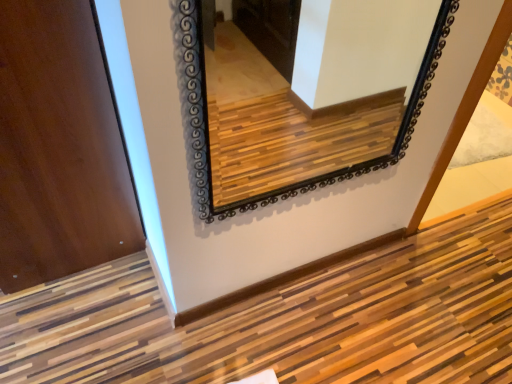
Where is `black glass mirror at upper center`? black glass mirror at upper center is located at coordinates (309, 93).

This screenshot has height=384, width=512. What do you see at coordinates (309, 93) in the screenshot? I see `black glass mirror at upper center` at bounding box center [309, 93].

What do you see at coordinates (59, 148) in the screenshot? This screenshot has height=384, width=512. I see `matte wood door at left` at bounding box center [59, 148].

Identify the location of matte wood door at left. This screenshot has width=512, height=384. (59, 148).

I want to click on black glass mirror at upper center, so click(309, 93).

Considering the relative positions of matte wood door at left and black glass mirror at upper center in the image provided, is matte wood door at left to the left of black glass mirror at upper center from the viewer's perspective?

Yes, matte wood door at left is to the left of black glass mirror at upper center.

Which object is further away from the camera, matte wood door at left or black glass mirror at upper center?

matte wood door at left is behind.

Considering the points (126, 196) and (369, 167), which point is in front, point (126, 196) or point (369, 167)?

The point (369, 167) is in front.

From the picture: From the image's perspective, is matte wood door at left above black glass mirror at upper center?

Yes.

From a real-world perspective, is matte wood door at left located higher than black glass mirror at upper center?

No, from a real-world perspective, matte wood door at left is not on top of black glass mirror at upper center.

Considering the relative sizes of matte wood door at left and black glass mirror at upper center in the image provided, is matte wood door at left wider than black glass mirror at upper center?

Indeed, matte wood door at left has a greater width compared to black glass mirror at upper center.

Considering the sizes of objects matte wood door at left and black glass mirror at upper center in the image provided, who is shorter, matte wood door at left or black glass mirror at upper center?

black glass mirror at upper center is shorter.

Is matte wood door at left smaller than black glass mirror at upper center?

Actually, matte wood door at left might be larger than black glass mirror at upper center.

Is black glass mirror at upper center completely or partially inside matte wood door at left?

No, black glass mirror at upper center is not a part of matte wood door at left.

Is there a large distance between matte wood door at left and black glass mirror at upper center?

Indeed, matte wood door at left is not near black glass mirror at upper center.

Is matte wood door at left oriented away from black glass mirror at upper center?

matte wood door at left is not turned away from black glass mirror at upper center.

Find the location of a particular element. The height and width of the screenshot is (384, 512). door lying above the black glass mirror at upper center (from the image's perspective) is located at coordinates (59, 148).

Which object is positioned more to the left, black glass mirror at upper center or matte wood door at left?

matte wood door at left is more to the left.

Consider the image. Considering their positions, is black glass mirror at upper center located in front of or behind matte wood door at left?

In the image, black glass mirror at upper center appears in front of matte wood door at left.

Is point (242, 78) closer or farther from the camera than point (10, 120)?

Point (242, 78).

From the image's perspective, is black glass mirror at upper center located beneath matte wood door at left?

Yes.

From a real-world perspective, which is physically below, black glass mirror at upper center or matte wood door at left?

matte wood door at left.

Is black glass mirror at upper center wider than matte wood door at left?

In fact, black glass mirror at upper center might be narrower than matte wood door at left.

Consider the image. Between black glass mirror at upper center and matte wood door at left, which one has less height?

black glass mirror at upper center.

Based on the photo, considering the sizes of objects black glass mirror at upper center and matte wood door at left in the image provided, who is bigger, black glass mirror at upper center or matte wood door at left?

matte wood door at left.

Is matte wood door at left a part of black glass mirror at upper center?

No, matte wood door at left is located outside of black glass mirror at upper center.

Is black glass mirror at upper center far away from matte wood door at left?

Yes, black glass mirror at upper center is far from matte wood door at left.

Is black glass mirror at upper center facing towards matte wood door at left?

No.

How much distance is there between black glass mirror at upper center and matte wood door at left?

1.05 meters.

Where is `mirror lying below the matte wood door at left (from the image's perspective)`? The height and width of the screenshot is (384, 512). mirror lying below the matte wood door at left (from the image's perspective) is located at coordinates (309, 93).

Locate an element on the screen. mirror above the matte wood door at left (from a real-world perspective) is located at coordinates (309, 93).

Locate an element on the screen. door that appears behind the black glass mirror at upper center is located at coordinates (59, 148).